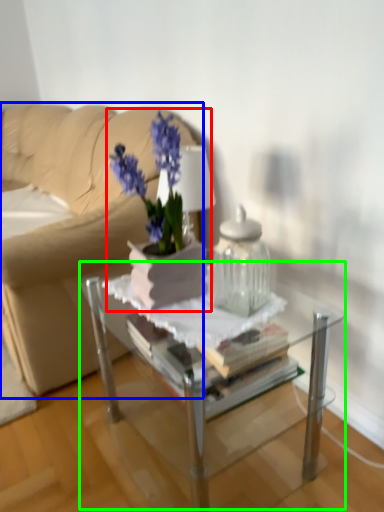
Question: Considering the real-world distances, which object is farthest from houseplant (highlighted by a red box)? studio couch (highlighted by a blue box) or table (highlighted by a green box)?

Choices:
 (A) studio couch
 (B) table

Answer: (A)